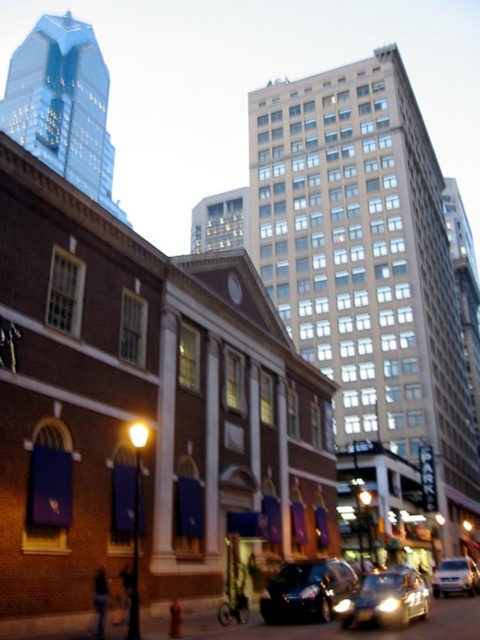
Question: Which of the following is the closest to the observer?

Choices:
 (A) shiny black sedan at center
 (B) shiny black car at center
 (C) silver metallic van at lower right

Answer: (A)

Question: Can you confirm if shiny black sedan at center is bigger than silver metallic van at lower right?

Choices:
 (A) yes
 (B) no

Answer: (B)

Question: Which object is the farthest from the shiny black sedan at center?

Choices:
 (A) silver metallic van at lower right
 (B) shiny black car at center

Answer: (A)

Question: Can you confirm if shiny black car at center is positioned above silver metallic van at lower right?

Choices:
 (A) yes
 (B) no

Answer: (A)

Question: Which of the following is the closest to the observer?

Choices:
 (A) shiny black car at center
 (B) silver metallic van at lower right

Answer: (A)

Question: Is shiny black car at center in front of silver metallic van at lower right?

Choices:
 (A) yes
 (B) no

Answer: (A)